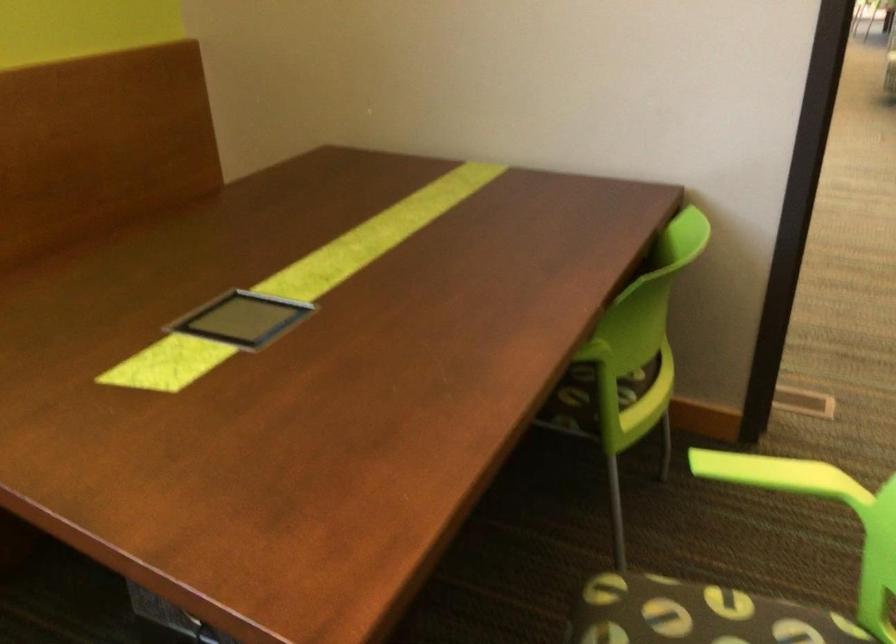
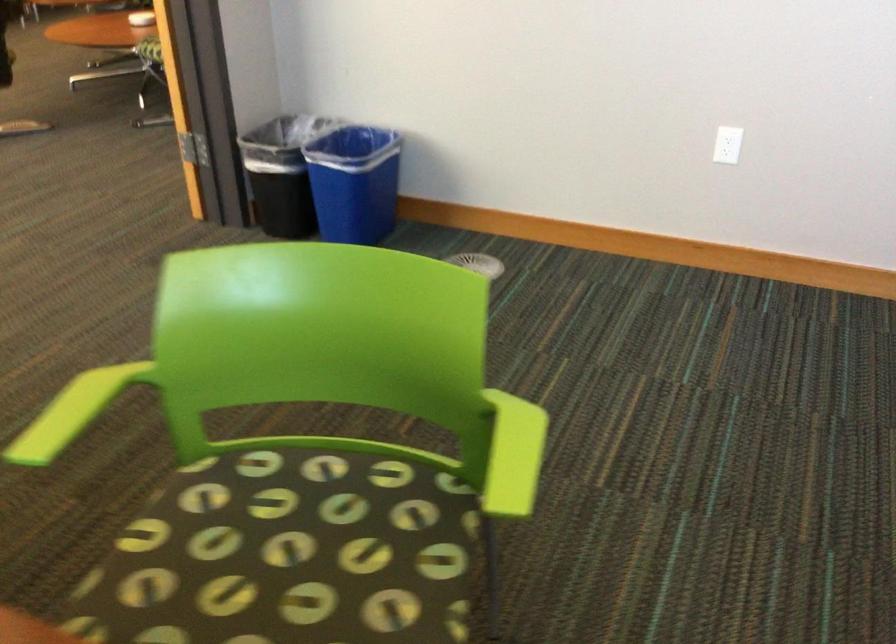
Locate, in the second image, the point that corresponds to point (708, 456) in the first image.

(55, 429)